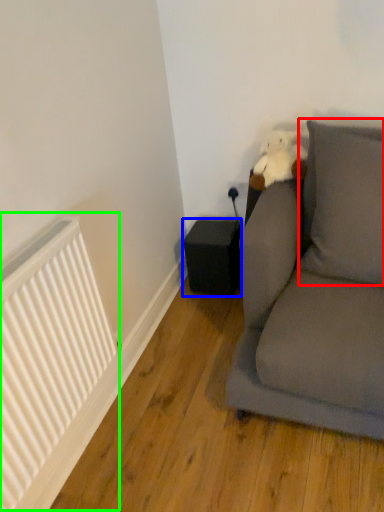
Question: Which object is positioned farthest from pillow (highlighted by a red box)? Select from speaker (highlighted by a blue box) and radiator (highlighted by a green box).

Choices:
 (A) speaker
 (B) radiator

Answer: (B)